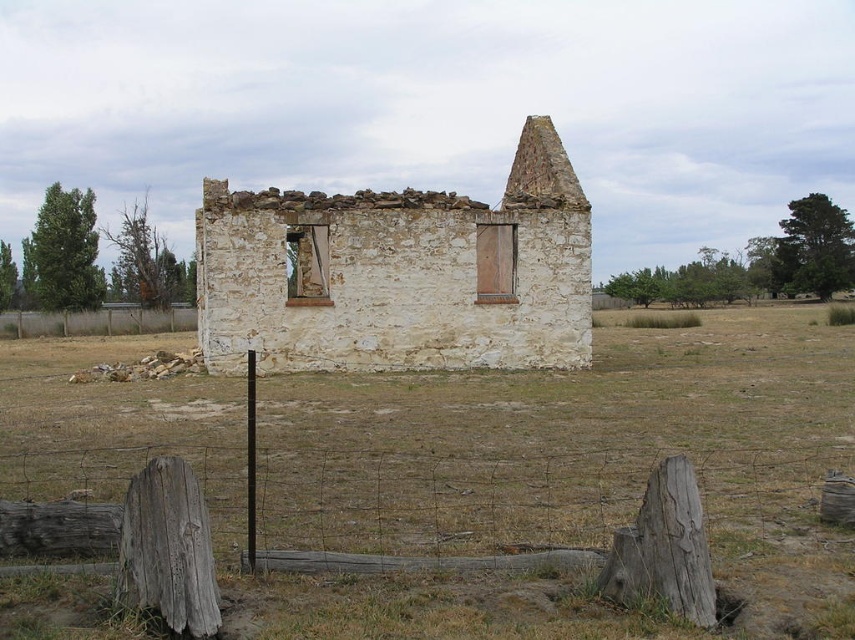
You are a painter wanting to capture the scene of the dilapidated stone structure. You notice the white stone wall at center and the brown wooden fence at lower left. Which object should you focus on if you want to paint something taller in the scene?

The white stone wall at center is taller than the brown wooden fence at lower left, so you should focus on painting the white stone wall at center.